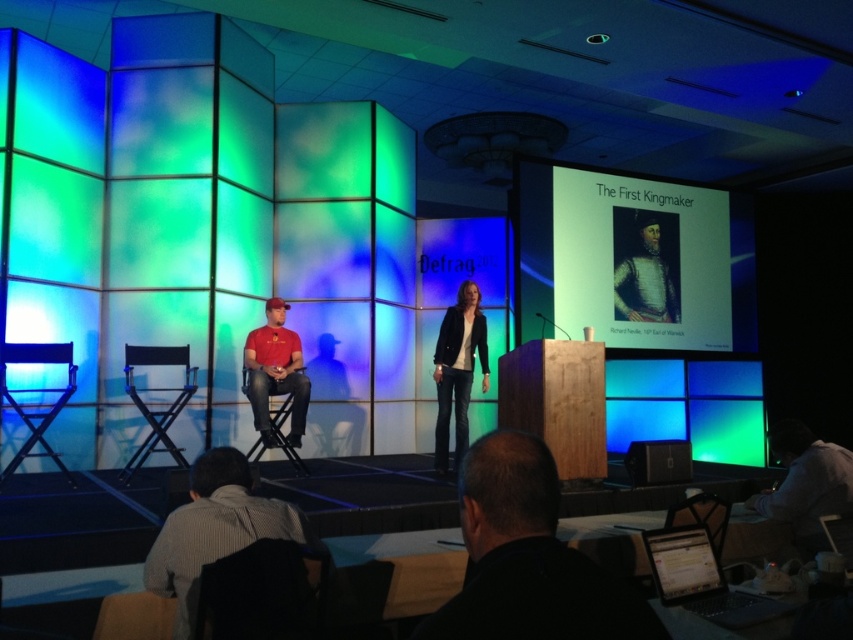
Question: Is matte red shirt at left wider than black fabric chair at left?

Choices:
 (A) no
 (B) yes

Answer: (A)

Question: Which point is closer to the camera?

Choices:
 (A) (834, 449)
 (B) (218, 477)
 (C) (285, 333)
 (D) (161, 358)

Answer: (B)

Question: Does matte red shirt at left have a greater width compared to metallic silver chair at lower right?

Choices:
 (A) yes
 (B) no

Answer: (B)

Question: Is gray striped shirt at lower left to the right of metallic blue chair at left from the viewer's perspective?

Choices:
 (A) yes
 (B) no

Answer: (A)

Question: Which of the following is the farthest from the observer?

Choices:
 (A) (300, 438)
 (B) (523, 522)
 (C) (222, 627)

Answer: (A)

Question: Which of the following is the farthest from the observer?

Choices:
 (A) (308, 564)
 (B) (189, 509)

Answer: (A)